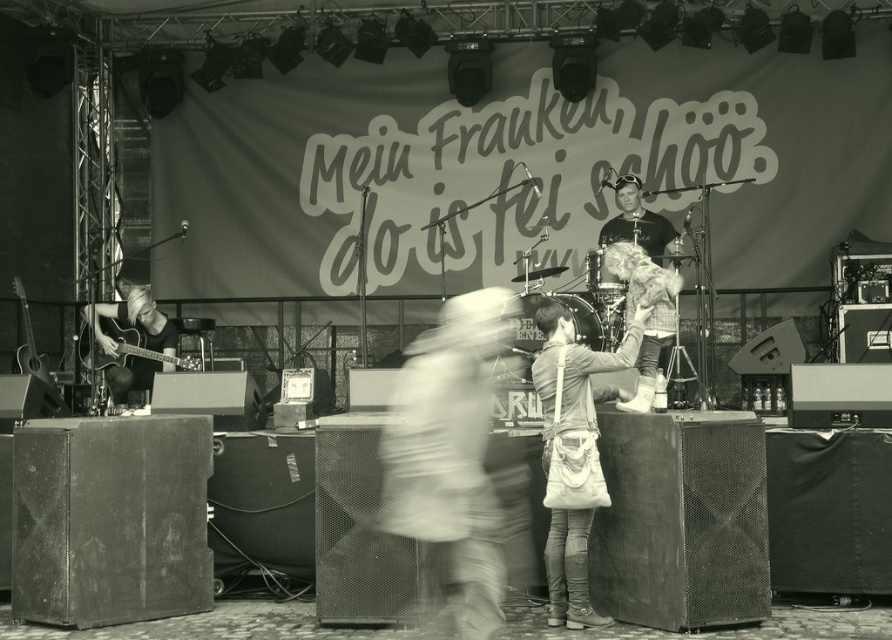
You are standing at the front of the stage and want to move towards the point labeled point (436, 486) and point (199, 369). Which point will you reach first?

Point (436, 486) is closer to the viewer than point (199, 369), so you will reach point (436, 486) first.

You are a photographer at the concert and want to capture the drummer in the center wearing both the smooth white shirt at center and the matte black shirt at center. Which shirt should you focus on to ensure the drummer is fully visible in the photo?

The smooth white shirt at center is below matte black shirt at center, so focusing on the matte black shirt at center will ensure the drummer is fully visible since it is positioned higher up.